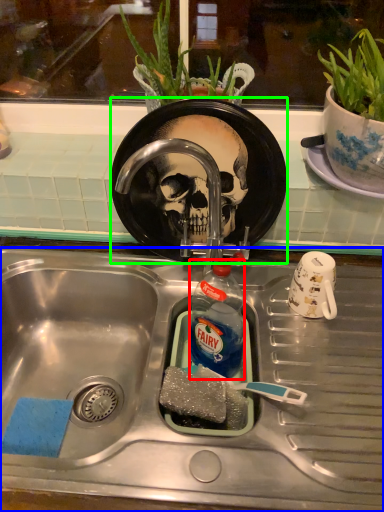
Question: Estimate the real-world distances between objects in this image. Which object is farther from bottle (highlighted by a red box), sink (highlighted by a blue box) or plate (highlighted by a green box)?

Choices:
 (A) sink
 (B) plate

Answer: (B)